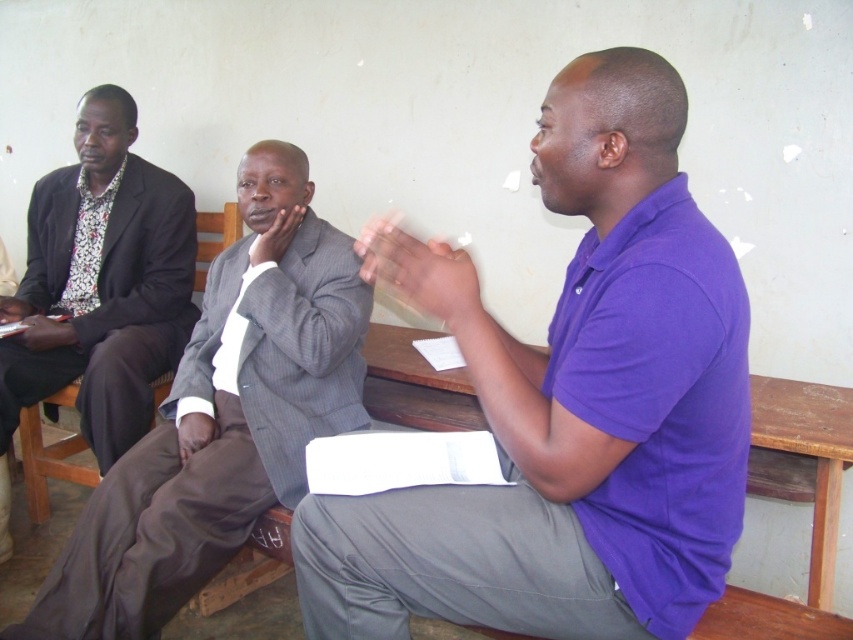
Question: Which of the following is the farthest from the observer?

Choices:
 (A) (601, 579)
 (B) (173, 545)

Answer: (B)

Question: Is gray pinstripe suit at center to the left of floral print shirt at left from the viewer's perspective?

Choices:
 (A) no
 (B) yes

Answer: (A)

Question: Which object is positioned closest to the purple cotton shirt at center?

Choices:
 (A) floral print shirt at left
 (B) gray pinstripe suit at center

Answer: (B)

Question: Which of the following is the farthest from the observer?

Choices:
 (A) (662, 301)
 (B) (7, 417)
 (C) (132, 566)

Answer: (B)

Question: Considering the relative positions of gray pinstripe suit at center and floral print shirt at left in the image provided, where is gray pinstripe suit at center located with respect to floral print shirt at left?

Choices:
 (A) above
 (B) below

Answer: (B)

Question: Is purple cotton shirt at center in front of floral print shirt at left?

Choices:
 (A) no
 (B) yes

Answer: (B)